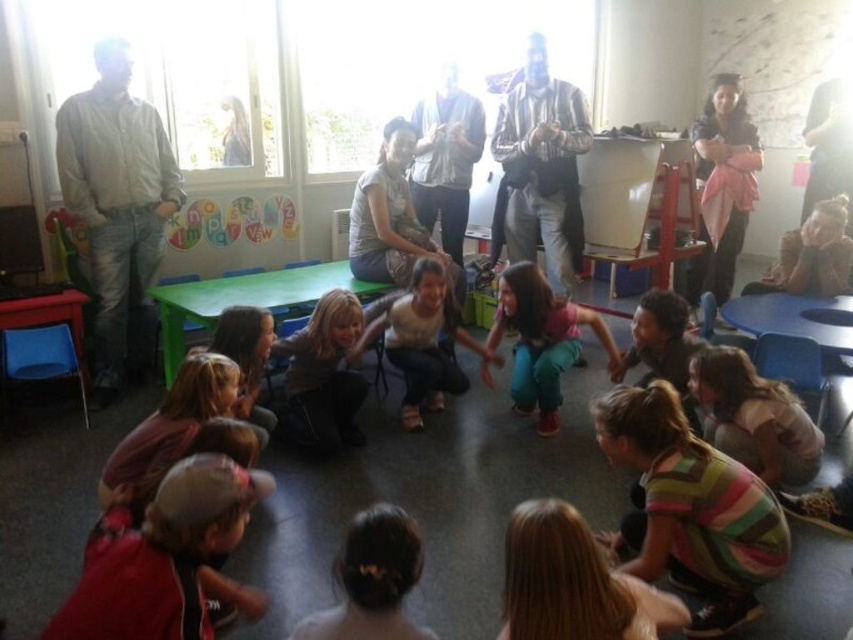
Question: Is striped fabric shirt at lower center positioned behind dark brown hair bun at center?

Choices:
 (A) yes
 (B) no

Answer: (A)

Question: Which point is closer to the camera?

Choices:
 (A) light gray shirt at left
 (B) striped fabric shirt at center

Answer: (A)

Question: Is the position of striped fabric shirt at lower center less distant than that of light brown fabric dress at center?

Choices:
 (A) no
 (B) yes

Answer: (B)

Question: Which of the following is the closest to the observer?

Choices:
 (A) striped fabric shirt at center
 (B) dark brown hair bun at center

Answer: (B)

Question: Among these points, which one is farthest from the camera?

Choices:
 (A) (315, 632)
 (B) (645, 300)

Answer: (B)

Question: In this image, where is striped fabric shirt at center located relative to dark brown hair bun at center?

Choices:
 (A) above
 (B) below

Answer: (A)